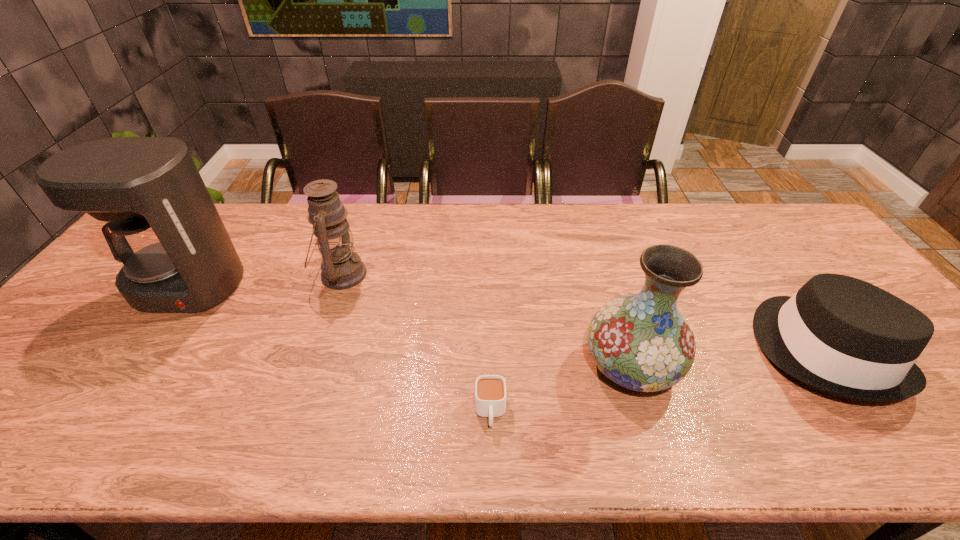
Locate an element on the screen. Image resolution: width=960 pixels, height=540 pixels. coffee maker is located at coordinates (176, 256).

What are the coordinates of `the leftmost object` in the screenshot? It's located at (176, 256).

Where is `the fourth object from left to right`? the fourth object from left to right is located at coordinates (642, 342).

Find the location of a particular element. This screenshot has width=960, height=540. oil lamp is located at coordinates (341, 268).

In order to click on the rightmost object in this screenshot , I will do `click(843, 336)`.

Identify the location of fedora. (843, 336).

Locate an element on the screen. This screenshot has height=540, width=960. the third object from right to left is located at coordinates (490, 390).

What are the coordinates of `the shortest object` in the screenshot? It's located at (490, 390).

Where is `free space located 0.230m on the button side of the coffee maker`? The width and height of the screenshot is (960, 540). free space located 0.230m on the button side of the coffee maker is located at coordinates (113, 392).

The width and height of the screenshot is (960, 540). I want to click on vacant space located 0.360m on the right of the fourth object from left to right, so click(x=830, y=366).